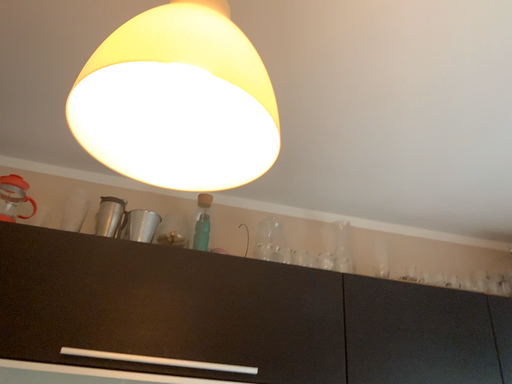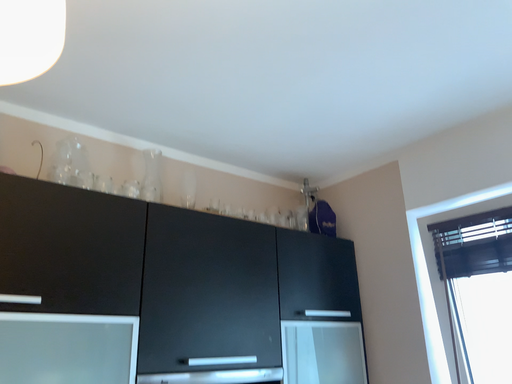
Question: Which way did the camera rotate in the video?

Choices:
 (A) rotated right
 (B) rotated left

Answer: (A)